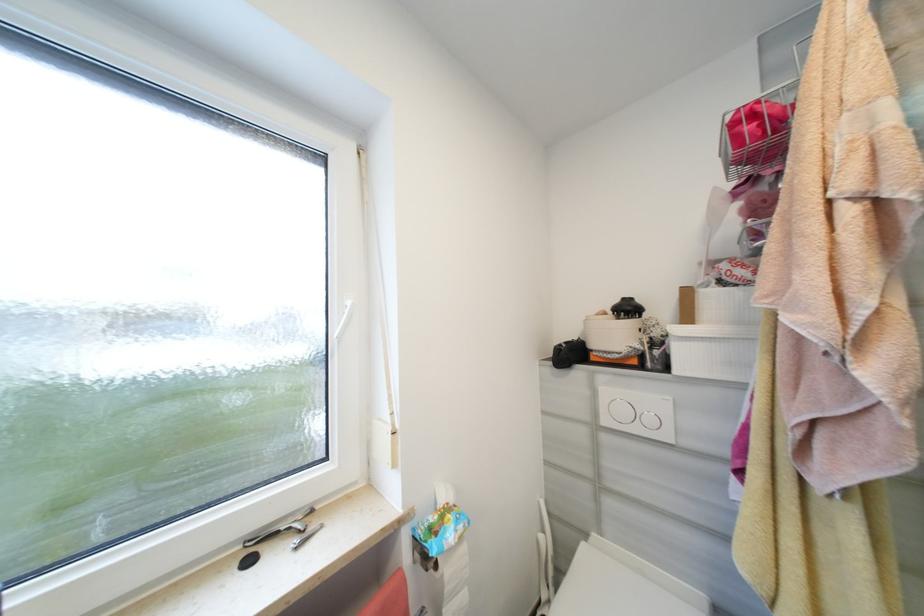
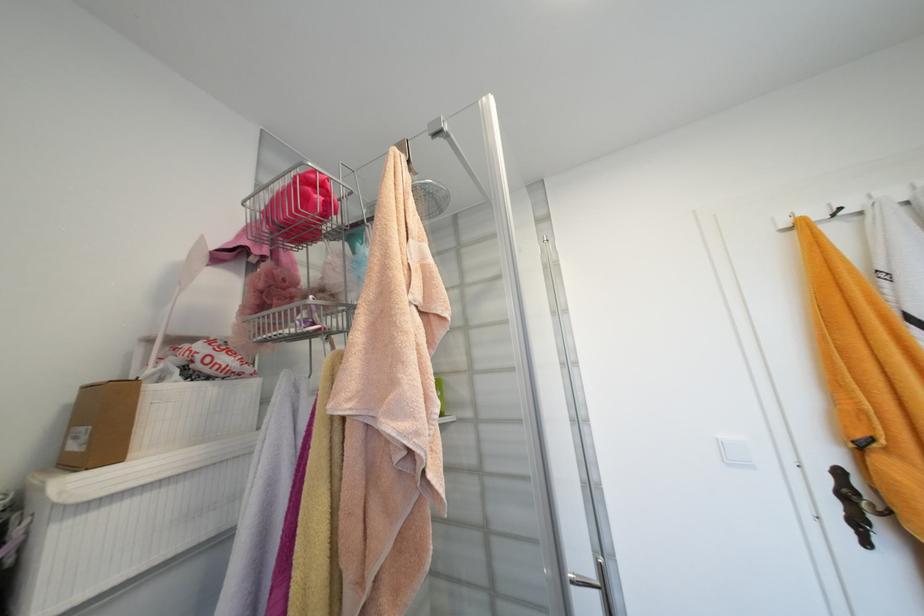
Locate, in the second image, the point that corresponds to [747,288] in the first image.

(224, 383)